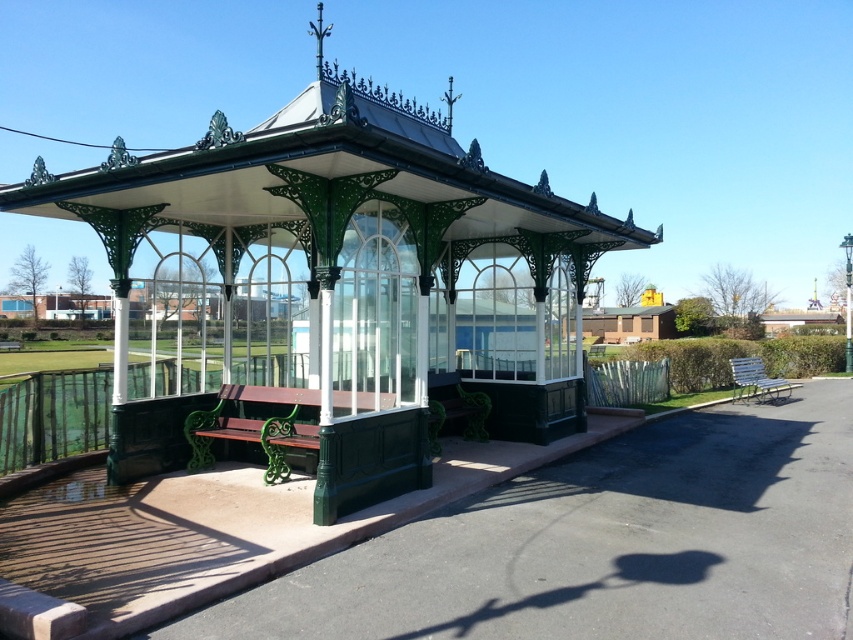
Does point (421, 180) come behind point (743, 392)?

No, (421, 180) is in front of (743, 392).

Who is more distant from viewer, (218, 275) or (782, 388)?

Positioned behind is point (782, 388).

Where is `green wrought iron gazebo at center`? The image size is (853, 640). green wrought iron gazebo at center is located at coordinates (335, 280).

Who is more forward, [552,368] or [363,397]?

Point [363,397]

Locate an element on the screen. Image resolution: width=853 pixels, height=640 pixels. green wrought iron gazebo at center is located at coordinates pyautogui.click(x=335, y=280).

How much distance is there between wooden bench at center and metallic silver bench at right?

wooden bench at center and metallic silver bench at right are 11.39 meters apart from each other.

Which is in front, point (222, 397) or point (787, 392)?

Point (222, 397)

Between point (283, 394) and point (743, 380), which one is positioned in front?

Positioned in front is point (283, 394).

Locate an element on the screen. wooden bench at center is located at coordinates (254, 426).